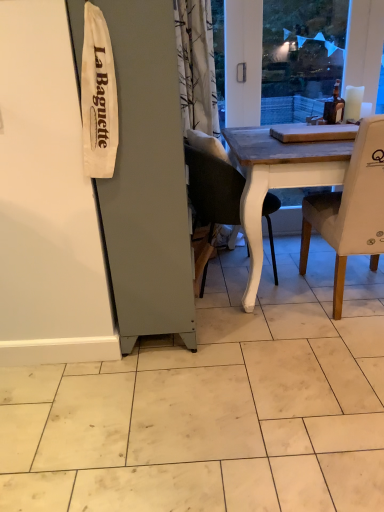
Where is `free space below white fabric chair at right, which ranks as the 2th chair in left-to-right order (from a real-world perspective)`? The height and width of the screenshot is (512, 384). free space below white fabric chair at right, which ranks as the 2th chair in left-to-right order (from a real-world perspective) is located at coordinates 350,296.